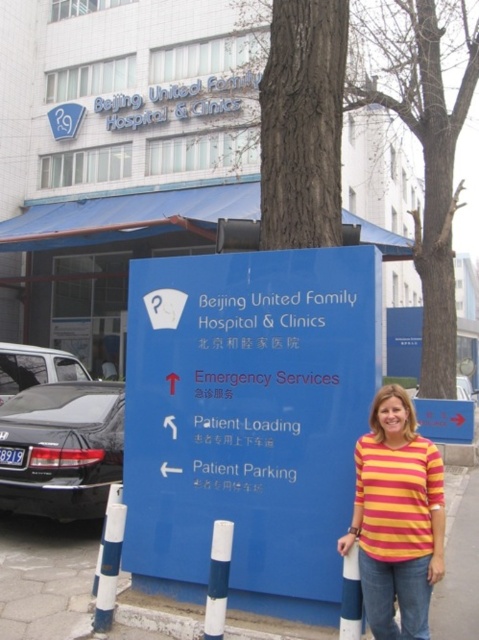
You are a visitor arriving at Beijing United Family Hospital. You see the blue plastic sign at center and the blue concrete pavement at lower center. Which object is taller?

The blue plastic sign at center is taller than the blue concrete pavement at lower center.

You are a visitor arriving at Beijing United Family Hospital. You see a bark at tree at upper center and a blue concrete pavement at lower center. Which object is higher in the image?

The bark at tree at upper center is higher in the image because it is positioned above the blue concrete pavement at lower center.

You are a visitor at Beijing United Family Hospital and see the bark at tree at upper center and the blue concrete pavement at lower center. Which object is wider?

The bark at tree at upper center is wider than the blue concrete pavement at lower center.